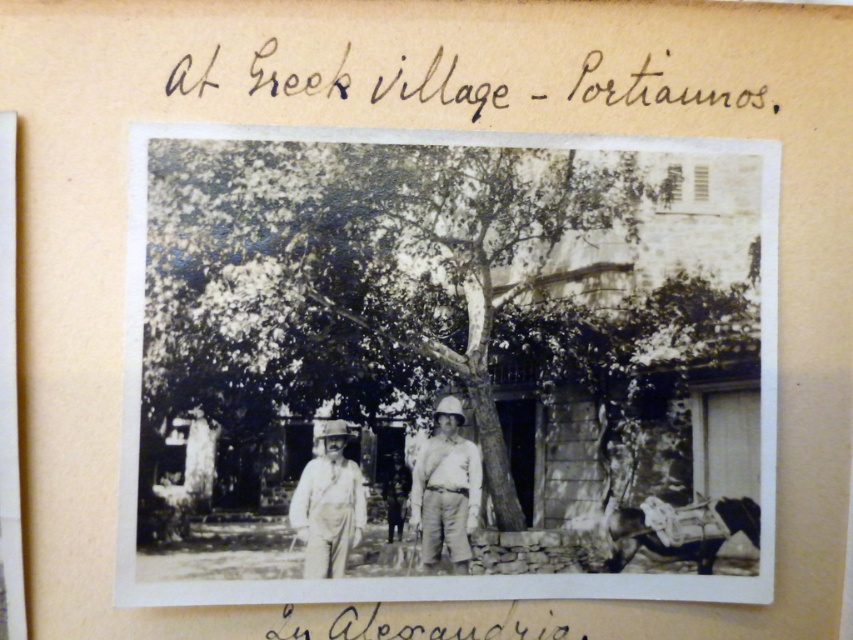
Question: Is smooth khaki shorts at center in front of black ink writing at lower center?

Choices:
 (A) no
 (B) yes

Answer: (A)

Question: Which object is the closest to the smooth khaki shorts at center?

Choices:
 (A) smooth bark tree at center
 (B) smooth white hat at center
 (C) black ink writing at lower center
 (D) black ink writing at upper center

Answer: (B)

Question: Can you confirm if black ink writing at upper center is positioned below black ink writing at lower center?

Choices:
 (A) no
 (B) yes

Answer: (A)

Question: Among these objects, which one is farthest from the camera?

Choices:
 (A) smooth bark tree at center
 (B) black ink writing at lower center
 (C) black ink writing at upper center

Answer: (C)

Question: Among these objects, which one is farthest from the camera?

Choices:
 (A) black ink writing at lower center
 (B) smooth bark tree at center
 (C) smooth khaki shorts at center

Answer: (C)

Question: Is black ink writing at upper center positioned behind smooth white hat at center?

Choices:
 (A) yes
 (B) no

Answer: (A)